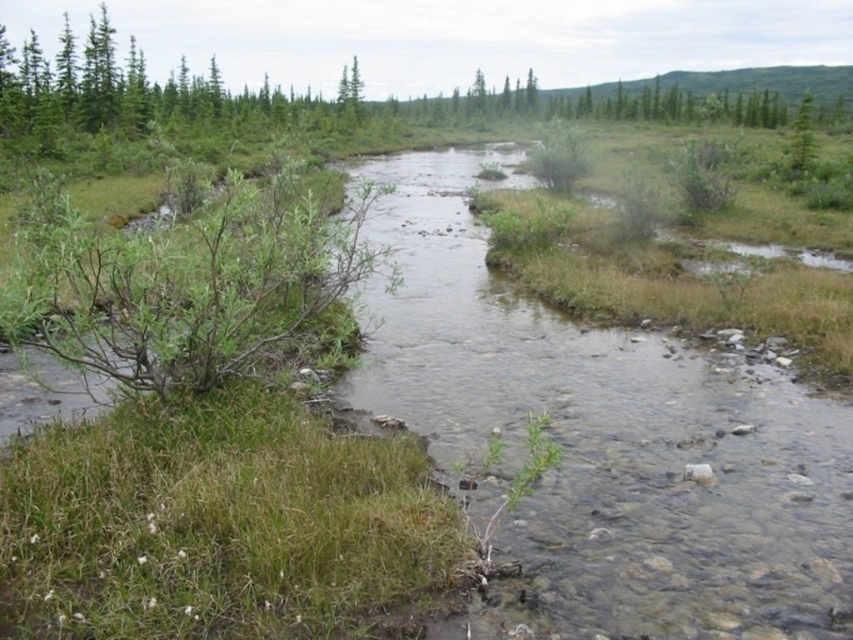
Question: Which object appears farthest from the camera in this image?

Choices:
 (A) clear water at center
 (B) green leafy tree at upper right

Answer: (B)

Question: Does clear water at center appear on the left side of green leafy tree at upper right?

Choices:
 (A) yes
 (B) no

Answer: (A)

Question: Which point is farther to the camera?

Choices:
 (A) green leafy tree at upper right
 (B) clear water at center

Answer: (A)

Question: Does clear water at center have a smaller size compared to green leafy tree at upper right?

Choices:
 (A) yes
 (B) no

Answer: (A)

Question: Does clear water at center appear under green leafy tree at upper right?

Choices:
 (A) yes
 (B) no

Answer: (A)